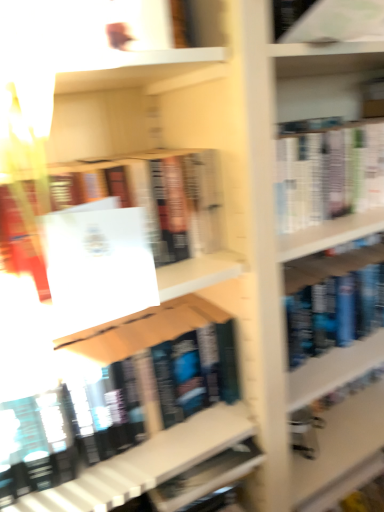
Identify the location of matte black book at center, which appears as the first book when ordered from the bottom. The width and height of the screenshot is (384, 512). (146, 463).

Describe the element at coordinates (97, 264) in the screenshot. Image resolution: width=384 pixels, height=512 pixels. I see `white matte paper at center` at that location.

Identify the location of matte black book at center, marked as the third book in a top-to-bottom arrangement. Image resolution: width=384 pixels, height=512 pixels. (146, 463).

Choose the correct answer: Is white paper at upper center, which is the second book from bottom to top, inside white paper at upper right, the 3th book in the bottom-to-top sequence, or outside it?

The correct answer is: outside.

From the image's perspective, which is below, white paper at upper center, which is the second book from bottom to top, or white paper at upper right, which appears as the first book when viewed from the top?

white paper at upper center, which is the second book from bottom to top, is shown below in the image.

Is the position of white paper at upper center, which is the second book from bottom to top, more distant than that of white paper at upper right, which appears as the first book when viewed from the top?

No.

Does white paper at upper right, which appears as the first book when viewed from the top, have a lesser height compared to matte black book at center, marked as the third book in a top-to-bottom arrangement?

Correct, white paper at upper right, which appears as the first book when viewed from the top, is not as tall as matte black book at center, marked as the third book in a top-to-bottom arrangement.

Is white paper at upper right, the 3th book in the bottom-to-top sequence, situated inside matte black book at center, marked as the third book in a top-to-bottom arrangement, or outside?

white paper at upper right, the 3th book in the bottom-to-top sequence, lies outside matte black book at center, marked as the third book in a top-to-bottom arrangement.

Are white paper at upper right, which appears as the first book when viewed from the top, and matte black book at center, which appears as the first book when ordered from the bottom, beside each other?

No, white paper at upper right, which appears as the first book when viewed from the top, is not making contact with matte black book at center, which appears as the first book when ordered from the bottom.

Considering the relative sizes of white paper at upper right, the 3th book in the bottom-to-top sequence, and matte black book at center, marked as the third book in a top-to-bottom arrangement, in the image provided, is white paper at upper right, the 3th book in the bottom-to-top sequence, thinner than matte black book at center, marked as the third book in a top-to-bottom arrangement,?

Indeed, white paper at upper right, the 3th book in the bottom-to-top sequence, has a lesser width compared to matte black book at center, marked as the third book in a top-to-bottom arrangement.

Based on the photo, can you confirm if white paper at upper right, which appears as the first book when viewed from the top, is positioned to the right of white paper at upper center, which is the second book from bottom to top?

Correct, you'll find white paper at upper right, which appears as the first book when viewed from the top, to the right of white paper at upper center, which is the second book from bottom to top.

From the image's perspective, which object appears higher, white paper at upper right, which appears as the first book when viewed from the top, or white paper at upper center, the second book from the top?

white paper at upper right, which appears as the first book when viewed from the top, appears higher in the image.

Can you confirm if white paper at upper right, the 3th book in the bottom-to-top sequence, is taller than white paper at upper center, which is the second book from bottom to top?

No, white paper at upper right, the 3th book in the bottom-to-top sequence, is not taller than white paper at upper center, which is the second book from bottom to top.

Measure the distance from white paper at upper right, which appears as the first book when viewed from the top, to white paper at upper center, which is the second book from bottom to top.

12.35 inches.

From the image's perspective, which is above, matte black book at center, marked as the third book in a top-to-bottom arrangement, or white paper at upper center, which is the second book from bottom to top?

white paper at upper center, which is the second book from bottom to top, is shown above in the image.

From a real-world perspective, between matte black book at center, marked as the third book in a top-to-bottom arrangement, and white paper at upper center, which is the second book from bottom to top, who is vertically higher?

white paper at upper center, which is the second book from bottom to top.

From a real-world perspective, which book is the 1st one above the matte black book at center, marked as the third book in a top-to-bottom arrangement? Please provide its 2D coordinates.

[(153, 195)]

Measure the distance between matte black book at center, marked as the third book in a top-to-bottom arrangement, and white paper at upper center, the second book from the top.

matte black book at center, marked as the third book in a top-to-bottom arrangement, and white paper at upper center, the second book from the top, are 14.82 inches apart from each other.

In the image, is white matte paper at center positioned in front of or behind matte black book at center, which appears as the first book when ordered from the bottom?

In the image, white matte paper at center appears in front of matte black book at center, which appears as the first book when ordered from the bottom.

Would you say white matte paper at center is inside or outside matte black book at center, which appears as the first book when ordered from the bottom?

The correct answer is: outside.

How many degrees apart are the facing directions of white matte paper at center and matte black book at center, marked as the third book in a top-to-bottom arrangement?

30.6 degrees.

From the image's perspective, which is above, white matte paper at center or matte black book at center, marked as the third book in a top-to-bottom arrangement?

From the image's view, white matte paper at center is above.

Does white paper at upper center, which is the second book from bottom to top, have a larger size compared to matte black book at center, marked as the third book in a top-to-bottom arrangement?

Actually, white paper at upper center, which is the second book from bottom to top, might be smaller than matte black book at center, marked as the third book in a top-to-bottom arrangement.

Who is more distant, white paper at upper center, the second book from the top, or matte black book at center, marked as the third book in a top-to-bottom arrangement?

matte black book at center, marked as the third book in a top-to-bottom arrangement, is further from the camera.

Is white paper at upper center, which is the second book from bottom to top, aimed at matte black book at center, marked as the third book in a top-to-bottom arrangement?

No, white paper at upper center, which is the second book from bottom to top, is not turned towards matte black book at center, marked as the third book in a top-to-bottom arrangement.

Which object is positioned more to the left, white paper at upper center, the second book from the top, or matte black book at center, marked as the third book in a top-to-bottom arrangement?

Positioned to the left is matte black book at center, marked as the third book in a top-to-bottom arrangement.

From the image's perspective, is matte black book at center, marked as the third book in a top-to-bottom arrangement, under white matte paper at center?

Yes, from the image's perspective, matte black book at center, marked as the third book in a top-to-bottom arrangement, is below white matte paper at center.

Is the depth of matte black book at center, marked as the third book in a top-to-bottom arrangement, greater than that of white matte paper at center?

Yes.

Does matte black book at center, marked as the third book in a top-to-bottom arrangement, have a greater width compared to white matte paper at center?

Answer: Indeed, matte black book at center, marked as the third book in a top-to-bottom arrangement, has a greater width compared to white matte paper at center.

Is matte black book at center, marked as the third book in a top-to-bottom arrangement, positioned with its back to white matte paper at center?

No, matte black book at center, marked as the third book in a top-to-bottom arrangement, is not facing the opposite direction of white matte paper at center.

Identify the location of the 2nd book in front when counting from the white paper at upper right, which appears as the first book when viewed from the top. (153, 195).

Find the location of a particular element. The width and height of the screenshot is (384, 512). book that is the 2nd object located above the matte black book at center, marked as the third book in a top-to-bottom arrangement (from the image's perspective) is located at coordinates (337, 21).

Looking at the image, which one is located further to white matte paper at center, white paper at upper right, the 3th book in the bottom-to-top sequence, or white paper at upper center, the second book from the top?

white paper at upper right, the 3th book in the bottom-to-top sequence.

Estimate the real-world distances between objects in this image. Which object is closer to white matte paper at center, matte black book at center, marked as the third book in a top-to-bottom arrangement, or white paper at upper center, the second book from the top?

white paper at upper center, the second book from the top, is closer to white matte paper at center.

When comparing their distances from white paper at upper right, the 3th book in the bottom-to-top sequence, does white paper at upper center, which is the second book from bottom to top, or matte black book at center, which appears as the first book when ordered from the bottom, seem closer?

white paper at upper center, which is the second book from bottom to top, is positioned closer to the anchor white paper at upper right, the 3th book in the bottom-to-top sequence.

Based on their spatial positions, is white matte paper at center or white paper at upper center, the second book from the top, further from matte black book at center, marked as the third book in a top-to-bottom arrangement?

white paper at upper center, the second book from the top, lies further to matte black book at center, marked as the third book in a top-to-bottom arrangement, than the other object.

Looking at the image, which one is located closer to white paper at upper right, the 3th book in the bottom-to-top sequence, white paper at upper center, which is the second book from bottom to top, or white matte paper at center?

The object closer to white paper at upper right, the 3th book in the bottom-to-top sequence, is white paper at upper center, which is the second book from bottom to top.

Which object lies further to the anchor point matte black book at center, marked as the third book in a top-to-bottom arrangement, white matte paper at center or white paper at upper right, which appears as the first book when viewed from the top?

Result: Among the two, white paper at upper right, which appears as the first book when viewed from the top, is located further to matte black book at center, marked as the third book in a top-to-bottom arrangement.

Looking at this image, based on their spatial positions, is white paper at upper right, the 3th book in the bottom-to-top sequence, or white matte paper at center closer to white paper at upper center, which is the second book from bottom to top?

Based on the image, white matte paper at center appears to be nearer to white paper at upper center, which is the second book from bottom to top.

From the image, which object appears to be farther from white paper at upper right, which appears as the first book when viewed from the top, matte black book at center, which appears as the first book when ordered from the bottom, or white matte paper at center?

matte black book at center, which appears as the first book when ordered from the bottom, lies further to white paper at upper right, which appears as the first book when viewed from the top, than the other object.

Identify the location of book between white paper at upper right, which appears as the first book when viewed from the top, and white matte paper at center from top to bottom. The image size is (384, 512). (153, 195).

Where is `paperback book between white paper at upper right, the 3th book in the bottom-to-top sequence, and matte black book at center, marked as the third book in a top-to-bottom arrangement, from top to bottom`? Image resolution: width=384 pixels, height=512 pixels. paperback book between white paper at upper right, the 3th book in the bottom-to-top sequence, and matte black book at center, marked as the third book in a top-to-bottom arrangement, from top to bottom is located at coordinates (97, 264).

Find the location of a particular element. The height and width of the screenshot is (512, 384). book between white paper at upper right, the 3th book in the bottom-to-top sequence, and matte black book at center, marked as the third book in a top-to-bottom arrangement, vertically is located at coordinates (153, 195).

Find the location of `paperback book that lies between white paper at upper center, the second book from the top, and matte black book at center, marked as the third book in a top-to-bottom arrangement, from top to bottom`. paperback book that lies between white paper at upper center, the second book from the top, and matte black book at center, marked as the third book in a top-to-bottom arrangement, from top to bottom is located at coordinates (97, 264).